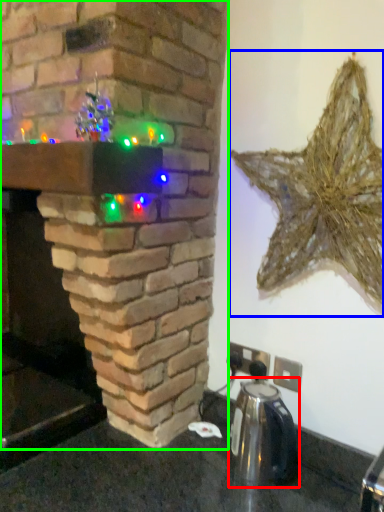
Question: Which object is positioned closest to appliance (highlighted by a red box)? Select from star (highlighted by a blue box) and fireplace (highlighted by a green box).

Choices:
 (A) star
 (B) fireplace

Answer: (A)